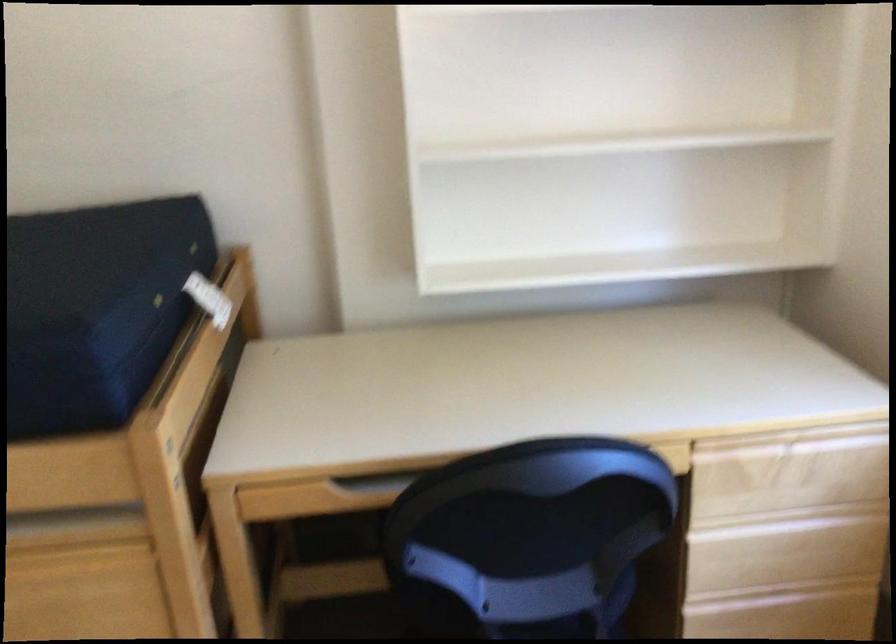
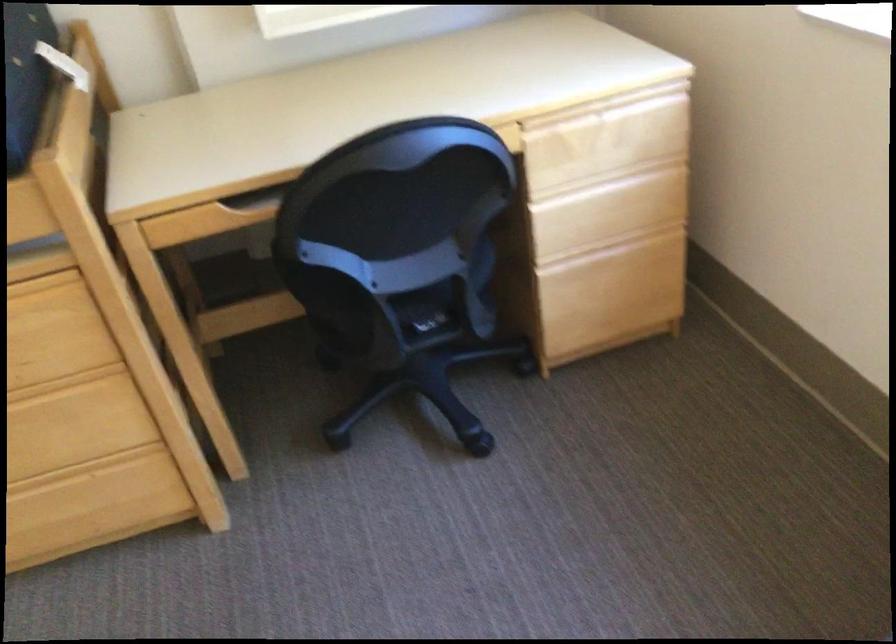
Where in the second image is the point corresponding to (x=800, y=433) from the first image?

(607, 106)